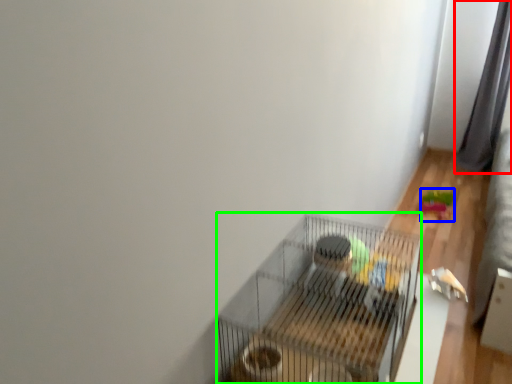
Question: Estimate the real-world distances between objects in this image. Which object is farther from curtain (highlighted by a red box), toy (highlighted by a blue box) or bird cage (highlighted by a green box)?

Choices:
 (A) toy
 (B) bird cage

Answer: (B)